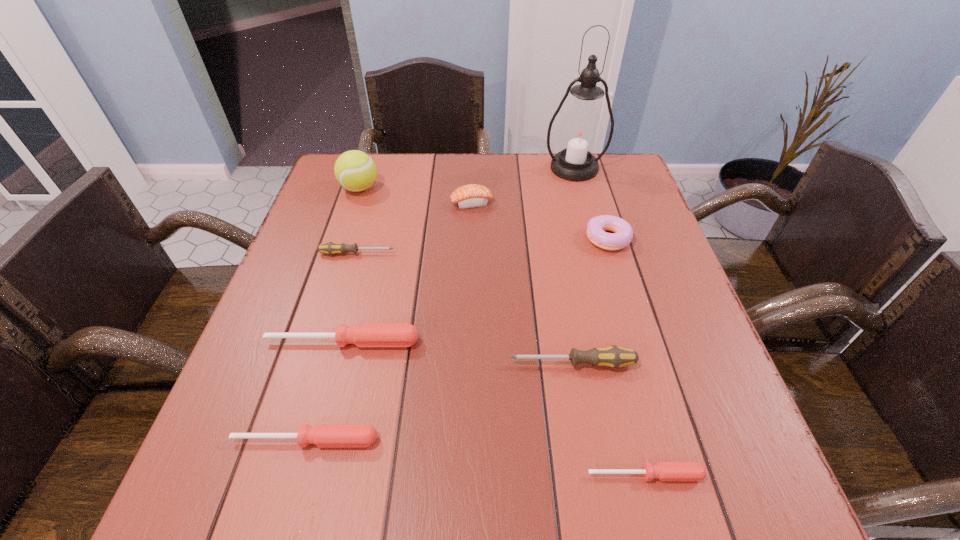
Locate an element on the screen. The image size is (960, 540). free space between the fourth nearest object and the seventh farthest object is located at coordinates (458, 353).

Locate which object is the fourth closest to the fifth object from right to left. Please provide its 2D coordinates. Your answer should be formatted as a tuple, i.e. [(x, y)], where the tuple contains the x and y coordinates of a point satisfying the conditions above.

[(623, 233)]

You are a GUI agent. You are given a task and a screenshot of the screen. Output one action in this format:
    pyautogui.click(x=<x>, y=<y>)
    Task: Click on the seventh closest object to the fourth nearest screwdriver
    
    Given the screenshot: What is the action you would take?
    pyautogui.click(x=354, y=170)

Find the location of a particular element. Image resolution: width=960 pixels, height=540 pixels. screwdriver that is the fourth closest one to the oil lamp is located at coordinates (665, 471).

Identify which screwdriver is the third nearest to the shortest screwdriver. Please provide its 2D coordinates. Your answer should be formatted as a tuple, i.e. [(x, y)], where the tuple contains the x and y coordinates of a point satisfying the conditions above.

[(364, 334)]

Identify which red screwdriver is the second closest to the shortest screwdriver. Please provide its 2D coordinates. Your answer should be formatted as a tuple, i.e. [(x, y)], where the tuple contains the x and y coordinates of a point satisfying the conditions above.

[(364, 334)]

Locate which red screwdriver ranks third in proximity to the sushi. Please provide its 2D coordinates. Your answer should be formatted as a tuple, i.e. [(x, y)], where the tuple contains the x and y coordinates of a point satisfying the conditions above.

[(665, 471)]

Where is `vacant space that satisfies the following two spatial constraints: 1. at the tip of the farther gray screwdriver; 2. on the back side of the farthest red screwdriver`? vacant space that satisfies the following two spatial constraints: 1. at the tip of the farther gray screwdriver; 2. on the back side of the farthest red screwdriver is located at coordinates (332, 342).

You are a GUI agent. You are given a task and a screenshot of the screen. Output one action in this format:
    pyautogui.click(x=<x>, y=<y>)
    Task: Click on the free location that satisfies the following two spatial constraints: 1. at the tip of the biggest red screwdriver; 2. on the left side of the farther gray screwdriver
    The height and width of the screenshot is (540, 960).
    Given the screenshot: What is the action you would take?
    pyautogui.click(x=332, y=342)

The width and height of the screenshot is (960, 540). What are the coordinates of `vacant region that satisfies the following two spatial constraints: 1. on the back side of the second farthest red screwdriver; 2. on the right side of the oil lamp` in the screenshot? It's located at (382, 168).